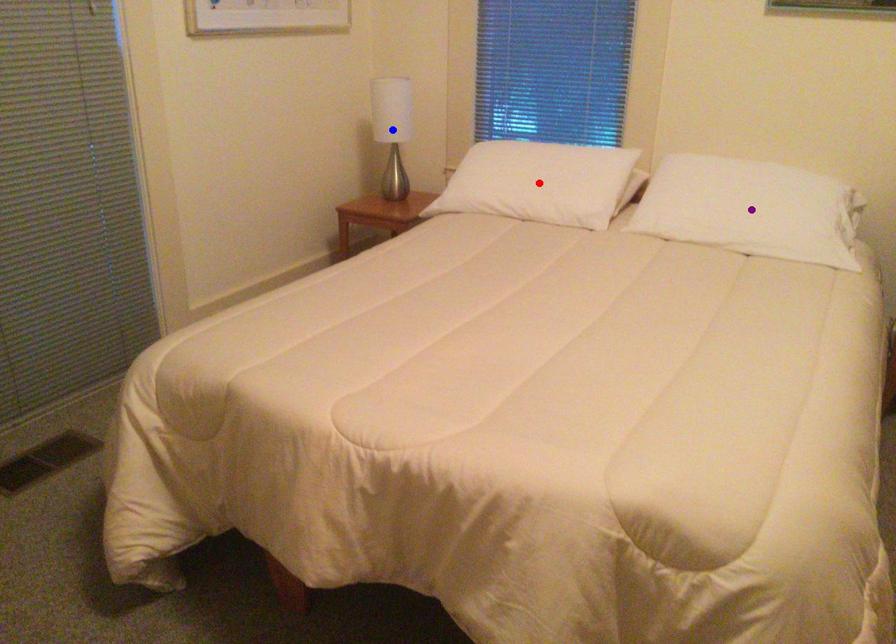
Order these from farthest to nearest:
red point | blue point | purple point

blue point < red point < purple point